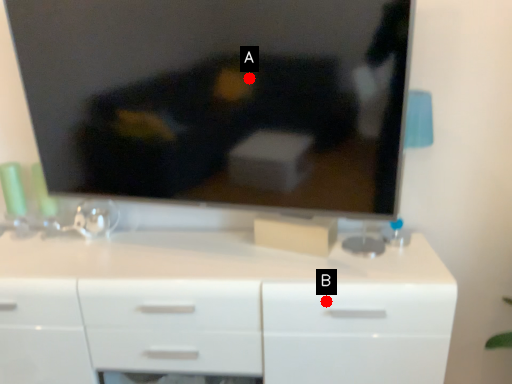
Question: Two points are circled on the image, labeled by A and B beside each circle. Which point is closer to the camera?

Choices:
 (A) A is closer
 (B) B is closer

Answer: (A)